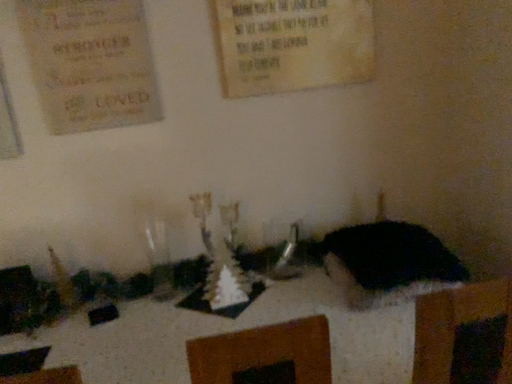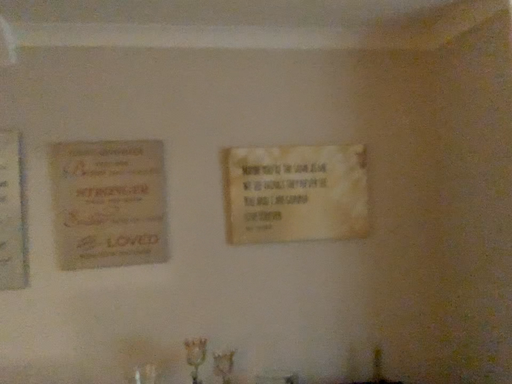
Question: Which way did the camera rotate in the video?

Choices:
 (A) rotated upward
 (B) rotated downward

Answer: (A)